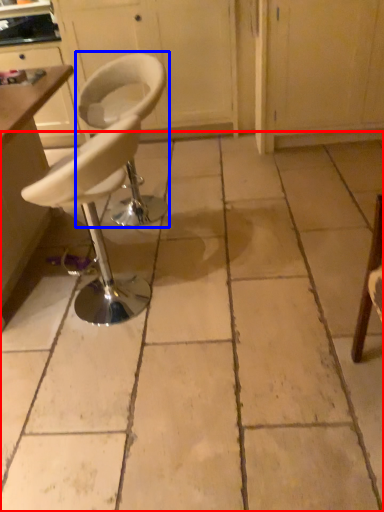
Question: Which of the following is the farthest to the observer, concrete (highlighted by a red box) or chair (highlighted by a blue box)?

Choices:
 (A) concrete
 (B) chair

Answer: (B)